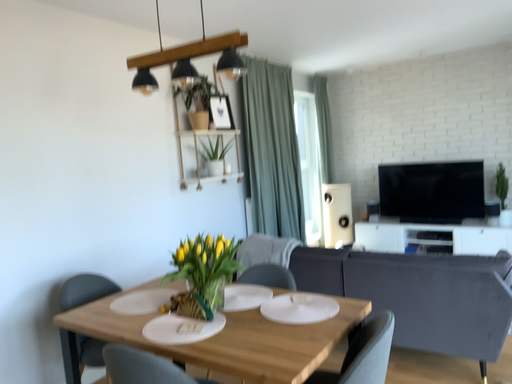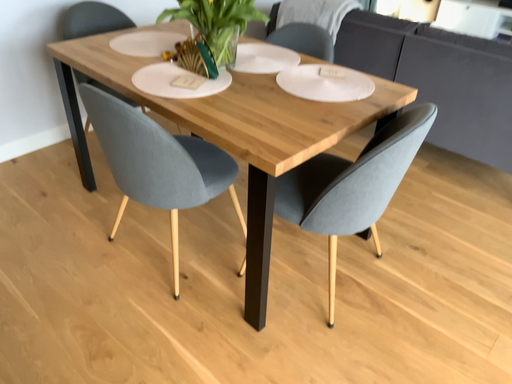
Question: Which way did the camera rotate in the video?

Choices:
 (A) rotated upward
 (B) rotated downward

Answer: (B)